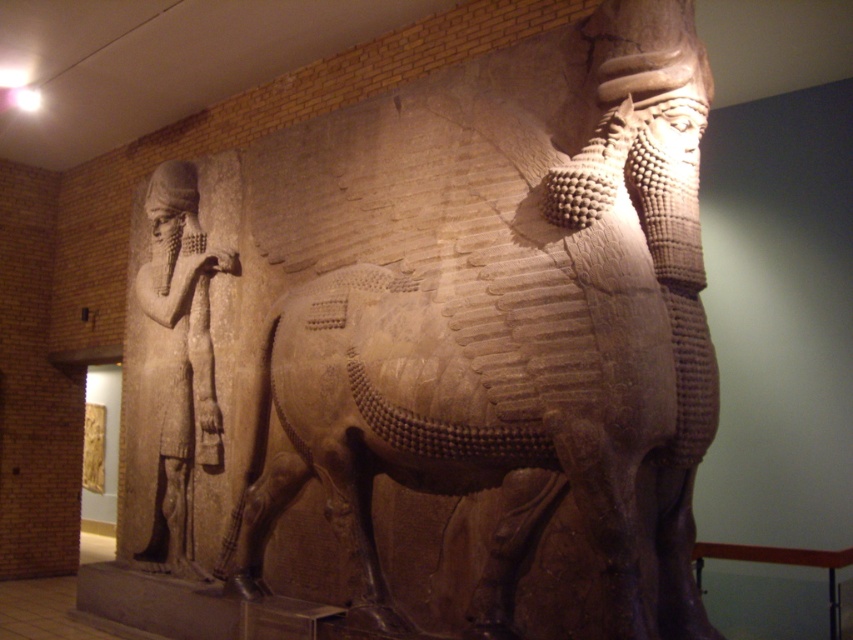
Question: Can you confirm if brown stone horse at center is positioned to the right of brown stone figure at left?

Choices:
 (A) no
 (B) yes

Answer: (B)

Question: Which point is farther to the camera?

Choices:
 (A) (141, 365)
 (B) (489, 84)

Answer: (A)

Question: Among these objects, which one is nearest to the camera?

Choices:
 (A) brown stone horse at center
 (B) brown stone figure at left

Answer: (A)

Question: Does brown stone horse at center come behind brown stone figure at left?

Choices:
 (A) yes
 (B) no

Answer: (B)

Question: Can you confirm if brown stone horse at center is bigger than brown stone figure at left?

Choices:
 (A) yes
 (B) no

Answer: (A)